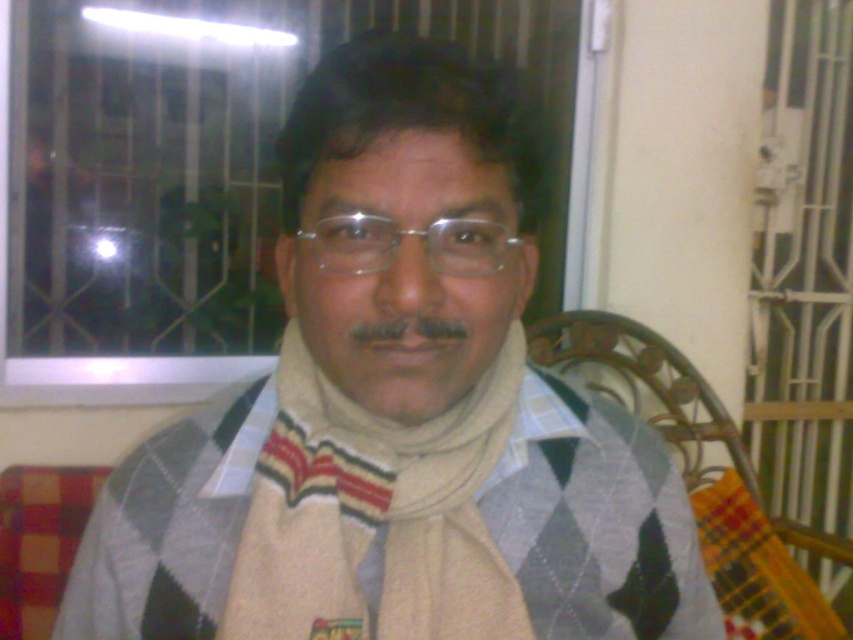
You are trying to reach for the clear plastic glasses at center but there is a beige knitted scarf at center in the way. Can you move the scarf to access the glasses?

The clear plastic glasses at center is behind the beige knitted scarf at center, so you can move the scarf to access the glasses.